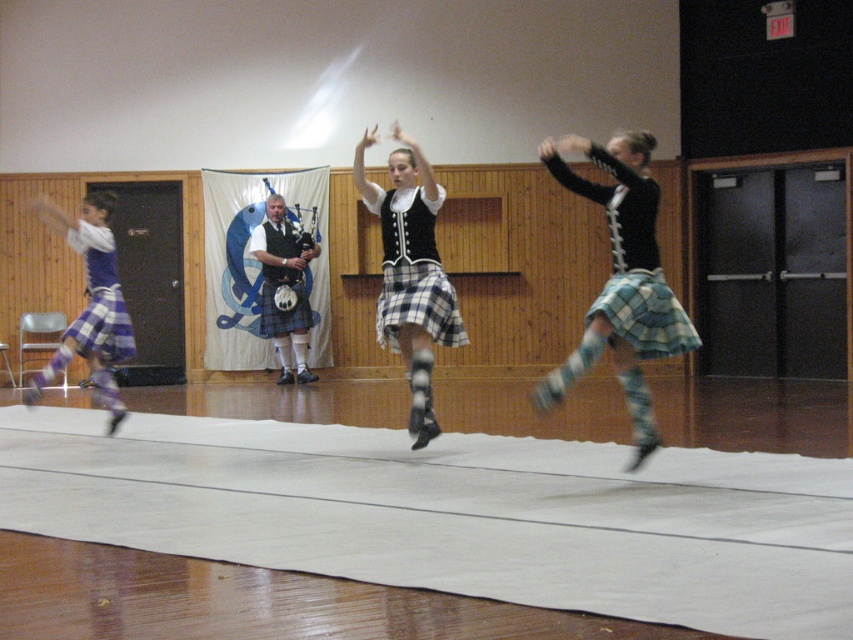
Question: From the image, what is the correct spatial relationship of black plaid skirt at center in relation to plaid fabric kilt at center?

Choices:
 (A) right
 (B) left

Answer: (B)

Question: Is plaid skirt at center wider than black plaid skirt at center?

Choices:
 (A) no
 (B) yes

Answer: (B)

Question: In this image, where is plaid skirt at center located relative to plaid skirt at left?

Choices:
 (A) below
 (B) above

Answer: (B)

Question: Estimate the real-world distances between objects in this image. Which object is closer to the black plaid skirt at center?

Choices:
 (A) plaid fabric kilt at center
 (B) plaid woolen kilt at right
 (C) plaid skirt at center

Answer: (A)

Question: Based on their relative distances, which object is farther from the plaid fabric kilt at center?

Choices:
 (A) plaid skirt at left
 (B) black plaid skirt at center
 (C) plaid woolen kilt at right

Answer: (A)

Question: Which point appears farthest from the camera in this image?

Choices:
 (A) (643, 314)
 (B) (633, 204)

Answer: (B)